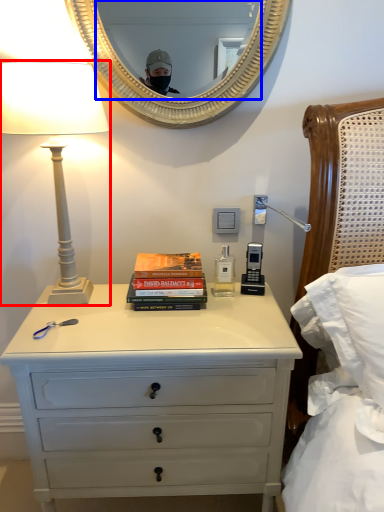
Question: Which point is further to the camera, lamp (highlighted by a red box) or mirror (highlighted by a blue box)?

Choices:
 (A) lamp
 (B) mirror

Answer: (B)